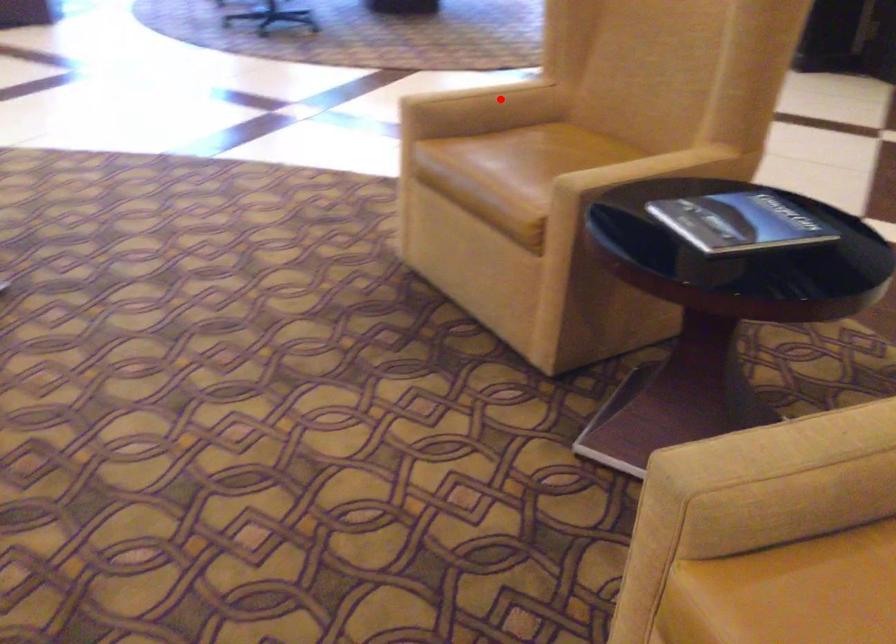
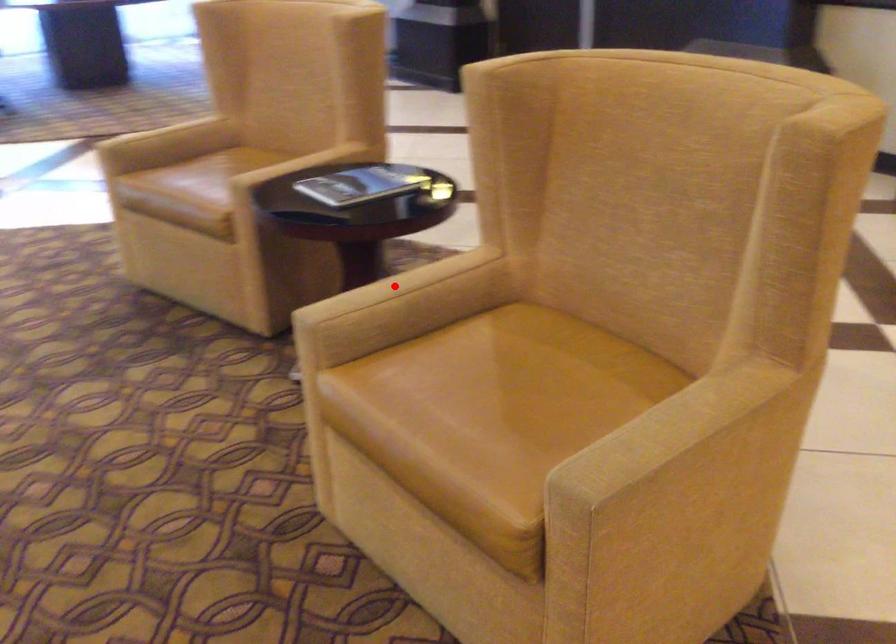
I am providing you with two images of the same scene from different viewpoints. A red point is marked on the first image and another point is marked on the second image. Do the highlighted points in image1 and image2 indicate the same real-world spot?

No